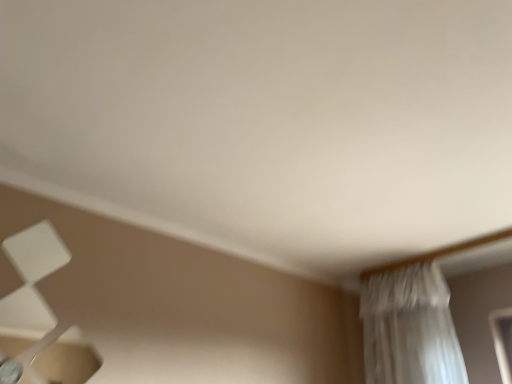
The height and width of the screenshot is (384, 512). I want to click on translucent fabric curtain at upper right, so click(410, 328).

Measure the distance between point (464,369) and camera.

Point (464,369) is 2.37 meters from camera.

Image resolution: width=512 pixels, height=384 pixels. What do you see at coordinates (410, 328) in the screenshot? I see `translucent fabric curtain at upper right` at bounding box center [410, 328].

Find the location of a particular element. The image size is (512, 384). translucent fabric curtain at upper right is located at coordinates (410, 328).